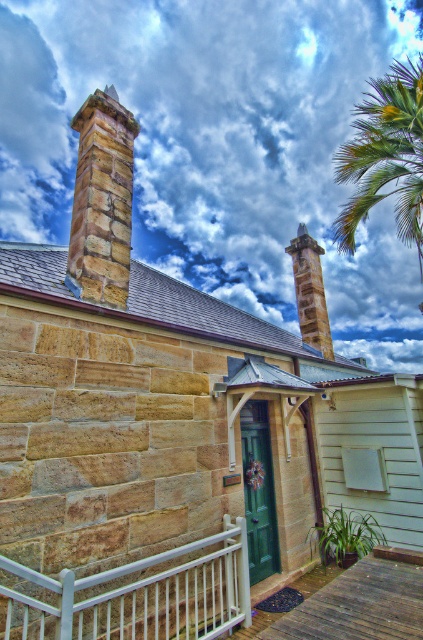
Who is shorter, brown stone chimney at upper left or brown stone chimney at center?

Standing shorter between the two is brown stone chimney at center.

Is point (85, 269) positioned after point (290, 252)?

No, (85, 269) is closer to viewer.

Between point (104, 240) and point (318, 276), which one is positioned behind?

The point (318, 276) is more distant.

The width and height of the screenshot is (423, 640). Identify the location of brown stone chimney at upper left. [x=101, y=202].

Between point (346, 131) and point (406, 74), which one is positioned behind?

The point (346, 131) is more distant.

Does white fluffy cloud at upper center have a greater height compared to green leafy palm tree at upper right?

Yes, white fluffy cloud at upper center is taller than green leafy palm tree at upper right.

Is point (200, 148) farther from viewer compared to point (409, 116)?

That is True.

You are a GUI agent. You are given a task and a screenshot of the screen. Output one action in this format:
    pyautogui.click(x=<x>, y=<y>)
    Task: Click on the white fluffy cloud at upper center
    The image size is (423, 640).
    Given the screenshot: What is the action you would take?
    pyautogui.click(x=219, y=145)

Can you confirm if white fluffy cloud at upper center is taller than brown stone chimney at upper left?

Indeed, white fluffy cloud at upper center has a greater height compared to brown stone chimney at upper left.

Is point (206, 256) farther from camera compared to point (110, 252)?

Yes, point (206, 256) is behind point (110, 252).

This screenshot has height=640, width=423. In order to click on white fluffy cloud at upper center in this screenshot , I will do tap(219, 145).